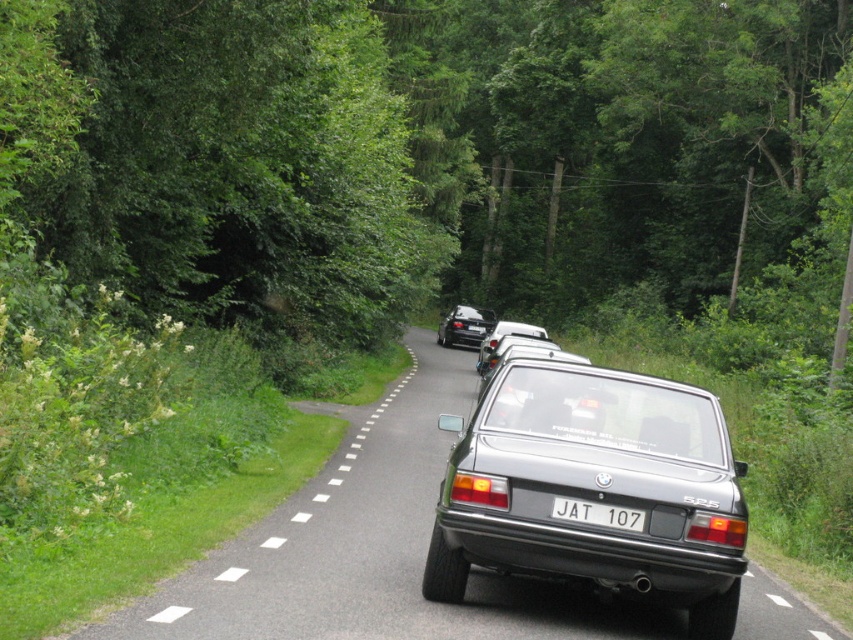
Who is more distant from viewer, (467, 333) or (490, 333)?

The point (467, 333) is more distant.

Does shiny black sedan at center have a greater width compared to satin silver sedan at center?

In fact, shiny black sedan at center might be narrower than satin silver sedan at center.

The height and width of the screenshot is (640, 853). Identify the location of shiny black sedan at center. (463, 324).

From the picture: Between white plastic line at center and white solid line at center, which one is positioned lower?

white solid line at center is lower down.

Is point (178, 605) positioned behind point (231, 577)?

No, (178, 605) is closer to viewer.

Which is behind, point (183, 611) or point (229, 580)?

The point (229, 580) is behind.

Where is `white plastic line at center`? white plastic line at center is located at coordinates (169, 612).

Between white plastic license plate at center and white solid line at center, which one appears on the right side from the viewer's perspective?

Positioned to the right is white plastic license plate at center.

Is white plastic license plate at center taller than white solid line at center?

Yes, white plastic license plate at center is taller than white solid line at center.

Who is more forward, [635,529] or [218,576]?

Positioned in front is point [635,529].

Find the location of a particular element. white plastic license plate at center is located at coordinates (596, 513).